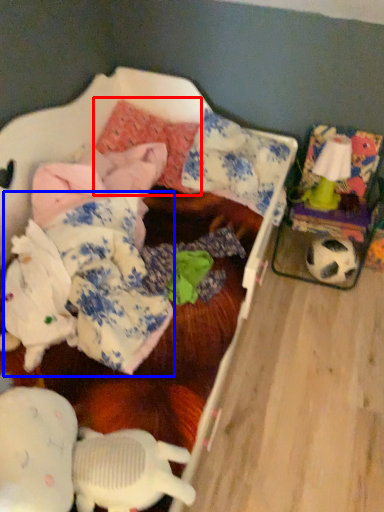
Question: Which object is further to the camera taking this photo, pillow (highlighted by a red box) or clothing (highlighted by a blue box)?

Choices:
 (A) pillow
 (B) clothing

Answer: (A)